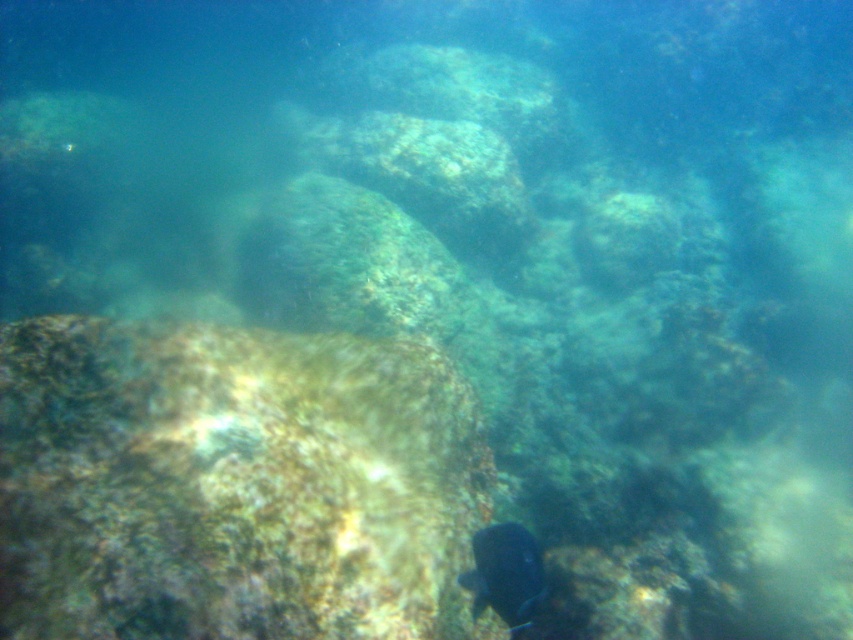
Is greenish-brown textured rock at center shorter than shiny blue fish at bottom right?

No.

Who is more distant from viewer, [48,531] or [538,580]?

The point [538,580] is more distant.

Who is more forward, (439,416) or (506,579)?

Positioned in front is point (506,579).

Identify the location of greenish-brown textured rock at center. (231, 483).